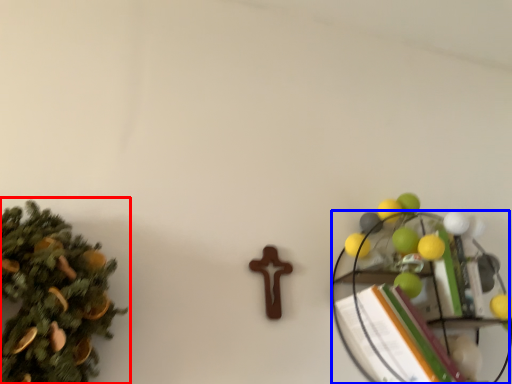
Question: Among these objects, which one is farthest to the camera, christmas tree (highlighted by a red box) or shelf (highlighted by a blue box)?

Choices:
 (A) christmas tree
 (B) shelf

Answer: (B)